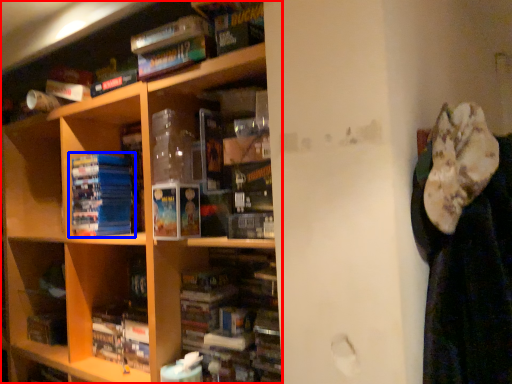
Question: Which of the following is the farthest to the observer, shelf (highlighted by a red box) or book (highlighted by a blue box)?

Choices:
 (A) shelf
 (B) book

Answer: (B)